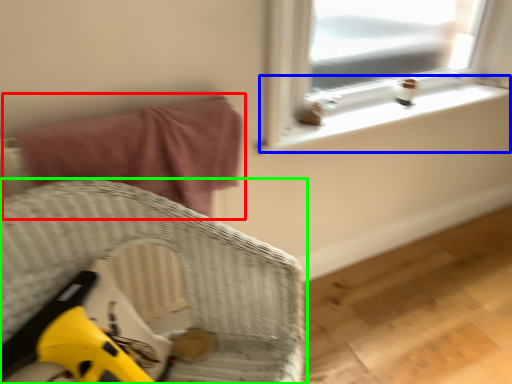
Question: Estimate the real-world distances between objects in this image. Which object is farther from bed (highlighted by a red box), window sill (highlighted by a blue box) or furniture (highlighted by a green box)?

Choices:
 (A) window sill
 (B) furniture

Answer: (A)